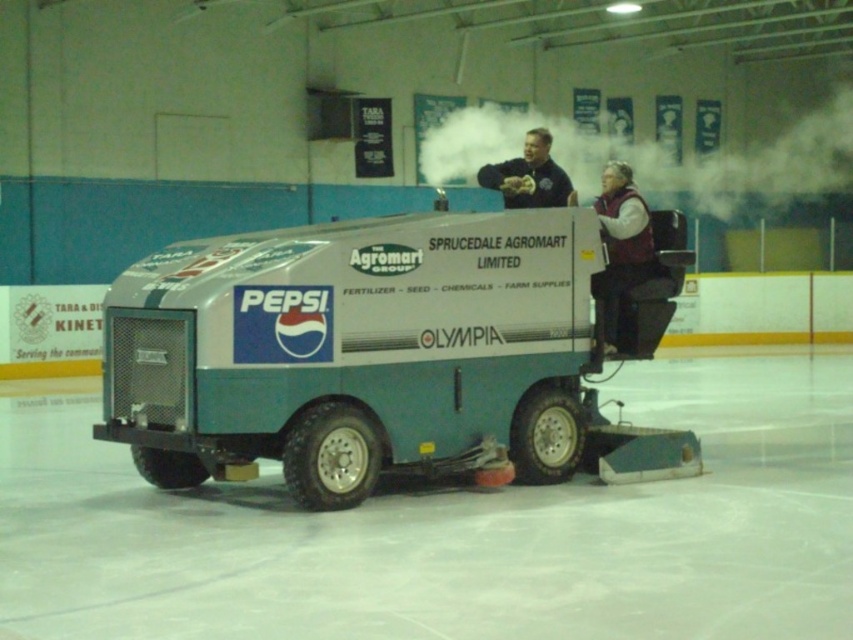
Between maroon fleece vest at center and dark blue jacket at upper center, which one is positioned lower?

maroon fleece vest at center is lower down.

Between maroon fleece vest at center and dark blue jacket at upper center, which one has less height?

dark blue jacket at upper center is shorter.

Where is `maroon fleece vest at center`? The width and height of the screenshot is (853, 640). maroon fleece vest at center is located at coordinates (619, 244).